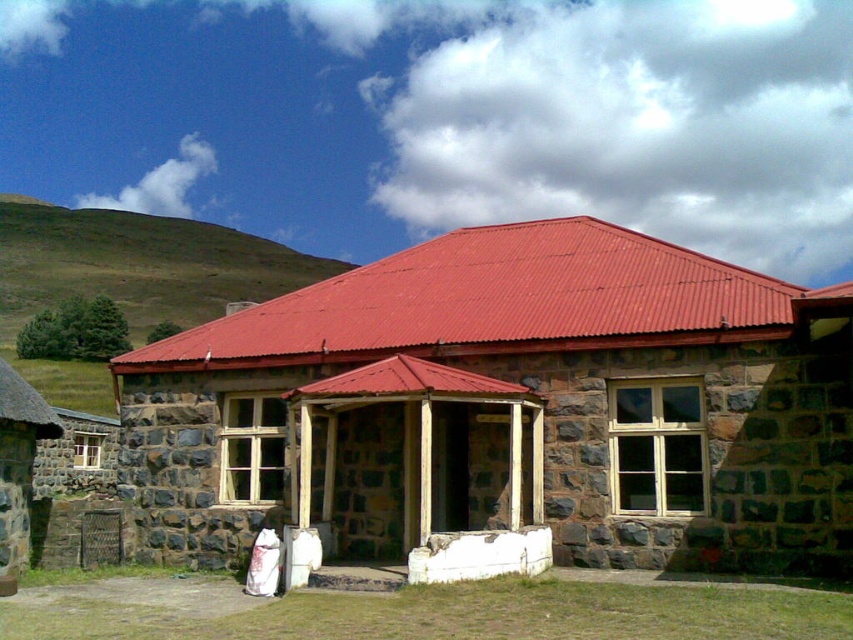
Question: Does stone textured hut at center have a larger size compared to green grassy hill at upper left?

Choices:
 (A) yes
 (B) no

Answer: (B)

Question: Can you confirm if stone textured hut at center is positioned to the right of green grassy hill at upper left?

Choices:
 (A) yes
 (B) no

Answer: (A)

Question: Where is stone textured hut at center located in relation to green grassy hill at upper left in the image?

Choices:
 (A) left
 (B) right

Answer: (B)

Question: Which point appears closest to the camera in this image?

Choices:
 (A) (32, 237)
 (B) (468, 513)

Answer: (B)

Question: Which point is farther to the camera?

Choices:
 (A) (534, 371)
 (B) (131, 218)

Answer: (B)